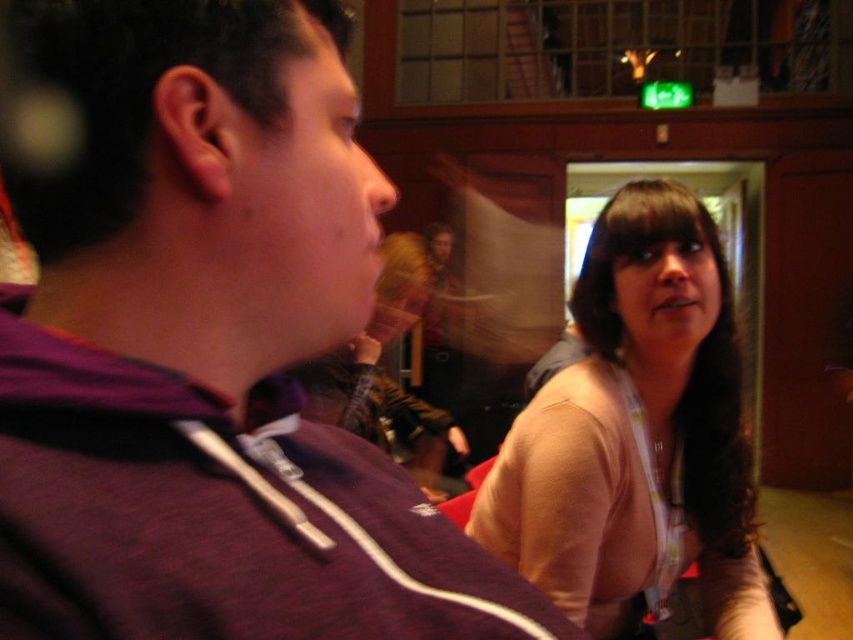
Question: Which of the following is the closest to the observer?

Choices:
 (A) (223, 170)
 (B) (680, 214)

Answer: (A)

Question: Can you confirm if purple fleece at center is positioned above light beige sweater at center?

Choices:
 (A) no
 (B) yes

Answer: (B)

Question: Does purple fleece at center have a greater width compared to light beige sweater at center?

Choices:
 (A) yes
 (B) no

Answer: (B)

Question: Can you confirm if purple fleece at center is wider than light beige sweater at center?

Choices:
 (A) no
 (B) yes

Answer: (A)

Question: Which point is farther to the camera?

Choices:
 (A) (270, 160)
 (B) (759, 604)

Answer: (B)